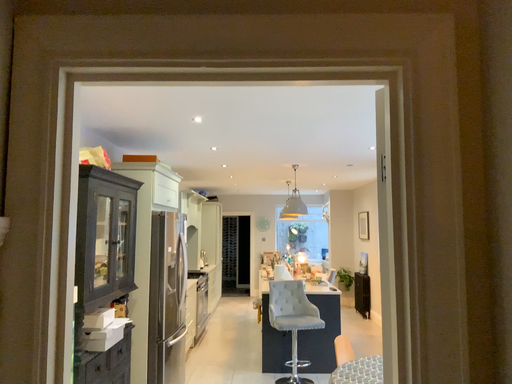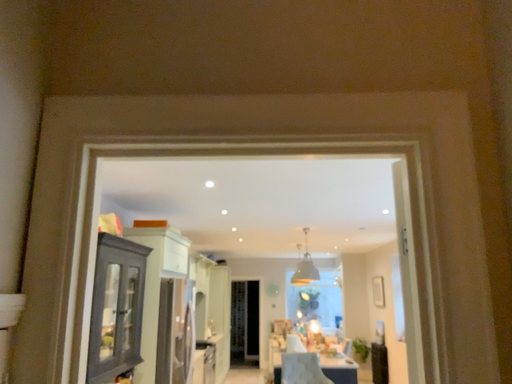
Question: How did the camera likely rotate when shooting the video?

Choices:
 (A) rotated upward
 (B) rotated downward

Answer: (A)